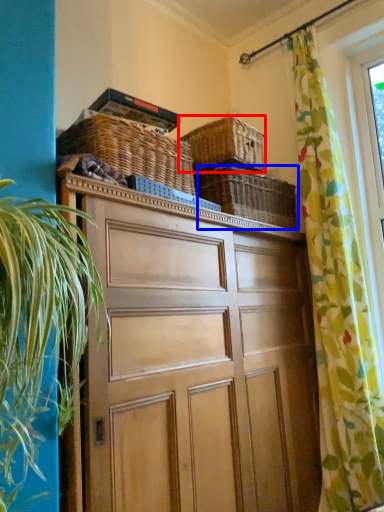
Question: Which object is closer to the camera taking this photo, basket (highlighted by a red box) or basket (highlighted by a blue box)?

Choices:
 (A) basket
 (B) basket

Answer: (A)